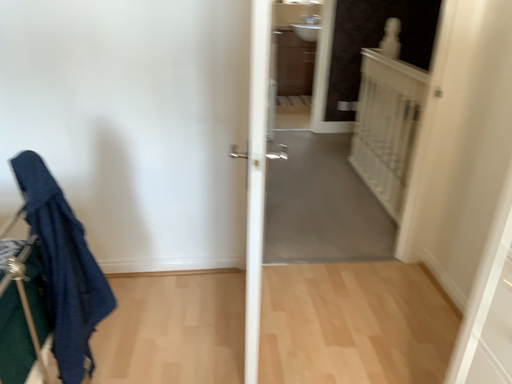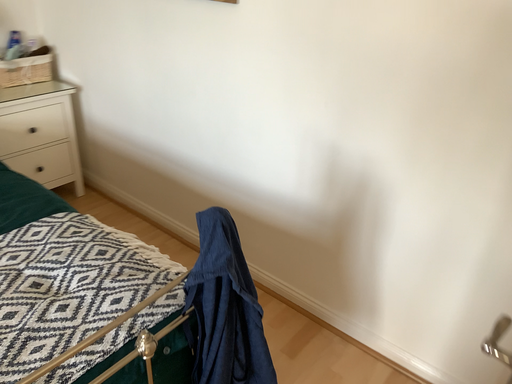
Question: Which way did the camera rotate in the video?

Choices:
 (A) rotated upward
 (B) rotated downward

Answer: (A)